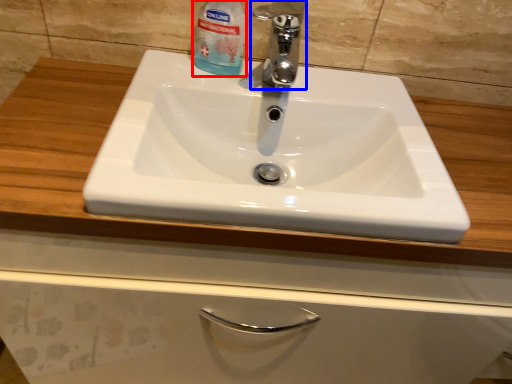
Question: Which object appears closest to the camera in this image, cleaning product (highlighted by a red box) or tap (highlighted by a blue box)?

Choices:
 (A) cleaning product
 (B) tap

Answer: (B)